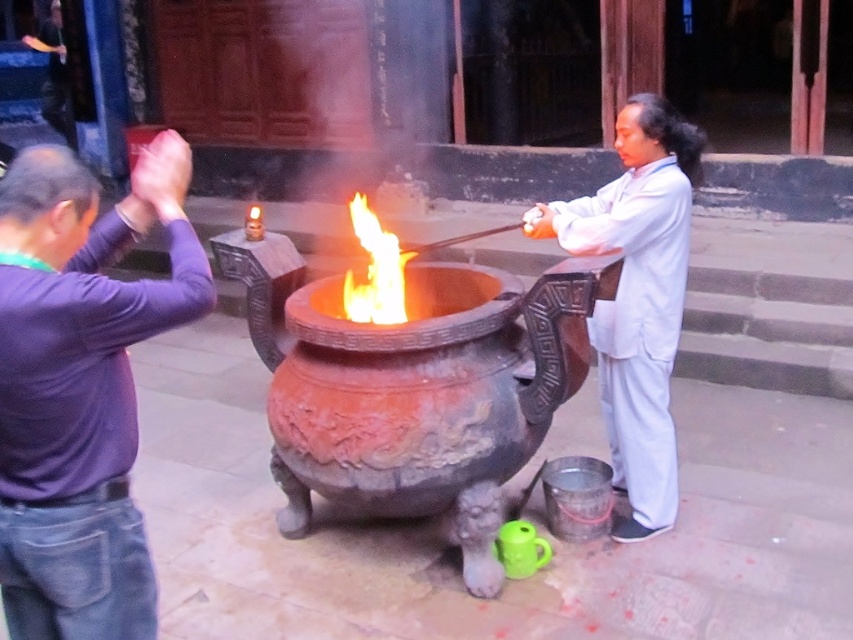
Question: Among these points, which one is farthest from the camera?

Choices:
 (A) (144, 333)
 (B) (668, 305)
 (C) (368, 208)

Answer: (C)

Question: Is purple cotton shirt at upper left thinner than flamematerial/texture at center?

Choices:
 (A) no
 (B) yes

Answer: (A)

Question: Which object is positioned closest to the purple cotton shirt at upper left?

Choices:
 (A) flamematerial/texture at center
 (B) white matte robe at center

Answer: (B)

Question: Which of these objects is positioned farthest from the white matte robe at center?

Choices:
 (A) purple cotton shirt at upper left
 (B) flamematerial/texture at center

Answer: (B)

Question: Does purple cotton shirt at upper left come in front of flamematerial/texture at center?

Choices:
 (A) yes
 (B) no

Answer: (A)

Question: Is purple cotton shirt at upper left wider than flamematerial/texture at center?

Choices:
 (A) no
 (B) yes

Answer: (B)